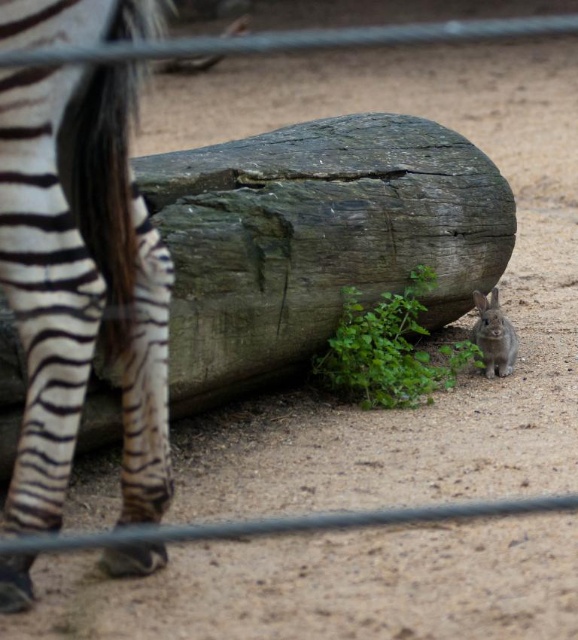
Question: Which object is positioned farthest from the gray furry rabbit at lower right?

Choices:
 (A) black and white striped zebra at left
 (B) green leafy plant at lower right

Answer: (A)

Question: Which of the following is the closest to the observer?

Choices:
 (A) (509, 340)
 (B) (340, 333)
 (C) (10, 104)

Answer: (C)

Question: Is black and white striped zebra at left positioned before green leafy plant at lower right?

Choices:
 (A) no
 (B) yes

Answer: (B)

Question: Is green leafy plant at lower right wider than gray furry rabbit at lower right?

Choices:
 (A) yes
 (B) no

Answer: (A)

Question: Which of the following is the closest to the observer?

Choices:
 (A) black and white striped zebra at left
 (B) gray furry rabbit at lower right
 (C) green leafy plant at lower right

Answer: (A)

Question: Considering the relative positions of black and white striped zebra at left and green leafy plant at lower right in the image provided, where is black and white striped zebra at left located with respect to green leafy plant at lower right?

Choices:
 (A) right
 (B) left

Answer: (B)